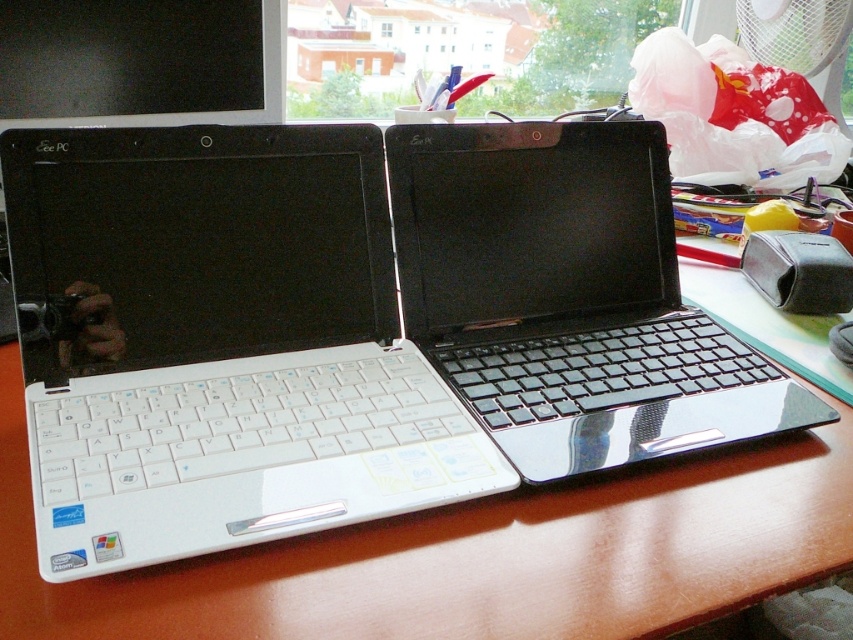
You need to move the white glossy laptop at left and the glossy black laptop at center to the right side of the desk. Which laptop should you move first to avoid blocking the other?

You should move the white glossy laptop at left first because it is to the left of the glossy black laptop at center, so moving it first will prevent blocking the path for moving the glossy black laptop at center.

You are a delivery person who needs to place a 16 inch box on the desk without covering the white glossy laptop at left. Can you fit it next to the laptop?

The white glossy laptop at left is 15.16 inches from the camera. Since the box is 16 inches, it might not fit next to the laptop without overlapping.

You have a small rectangular object that is 15 cm wide. You want to place it on the desk between the wooden at center and the glossy black laptop at center. Is there enough space for it?

The wooden at center is wider than the glossy black laptop at center. Therefore, the space between them may vary depending on their exact positions. However, since the wooden desk is likely much larger than the laptop, there should be sufficient space for the 15 cm wide object between them.